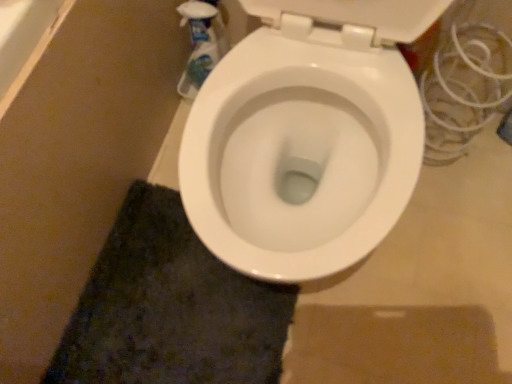
Question: From the image's perspective, is dark green shaggy carpet at lower left on translucent plastic spray bottle at upper left?

Choices:
 (A) no
 (B) yes

Answer: (A)

Question: Is dark green shaggy carpet at lower left behind translucent plastic spray bottle at upper left?

Choices:
 (A) no
 (B) yes

Answer: (A)

Question: Does dark green shaggy carpet at lower left appear on the left side of translucent plastic spray bottle at upper left?

Choices:
 (A) yes
 (B) no

Answer: (A)

Question: From the image's perspective, is dark green shaggy carpet at lower left under translucent plastic spray bottle at upper left?

Choices:
 (A) yes
 (B) no

Answer: (A)

Question: Can we say dark green shaggy carpet at lower left lies outside translucent plastic spray bottle at upper left?

Choices:
 (A) no
 (B) yes

Answer: (B)

Question: Is dark green shaggy carpet at lower left positioned before translucent plastic spray bottle at upper left?

Choices:
 (A) no
 (B) yes

Answer: (B)

Question: Can you confirm if translucent plastic spray bottle at upper left is shorter than dark green shaggy carpet at lower left?

Choices:
 (A) yes
 (B) no

Answer: (B)

Question: From the image's perspective, is translucent plastic spray bottle at upper left below dark green shaggy carpet at lower left?

Choices:
 (A) yes
 (B) no

Answer: (B)

Question: Is translucent plastic spray bottle at upper left further to camera compared to dark green shaggy carpet at lower left?

Choices:
 (A) yes
 (B) no

Answer: (A)

Question: Is dark green shaggy carpet at lower left inside translucent plastic spray bottle at upper left?

Choices:
 (A) yes
 (B) no

Answer: (B)

Question: Is translucent plastic spray bottle at upper left positioned in front of dark green shaggy carpet at lower left?

Choices:
 (A) no
 (B) yes

Answer: (A)

Question: From a real-world perspective, is translucent plastic spray bottle at upper left positioned over dark green shaggy carpet at lower left based on gravity?

Choices:
 (A) yes
 (B) no

Answer: (A)

Question: Would you say dark green shaggy carpet at lower left is to the left or to the right of translucent plastic spray bottle at upper left in the picture?

Choices:
 (A) right
 (B) left

Answer: (B)